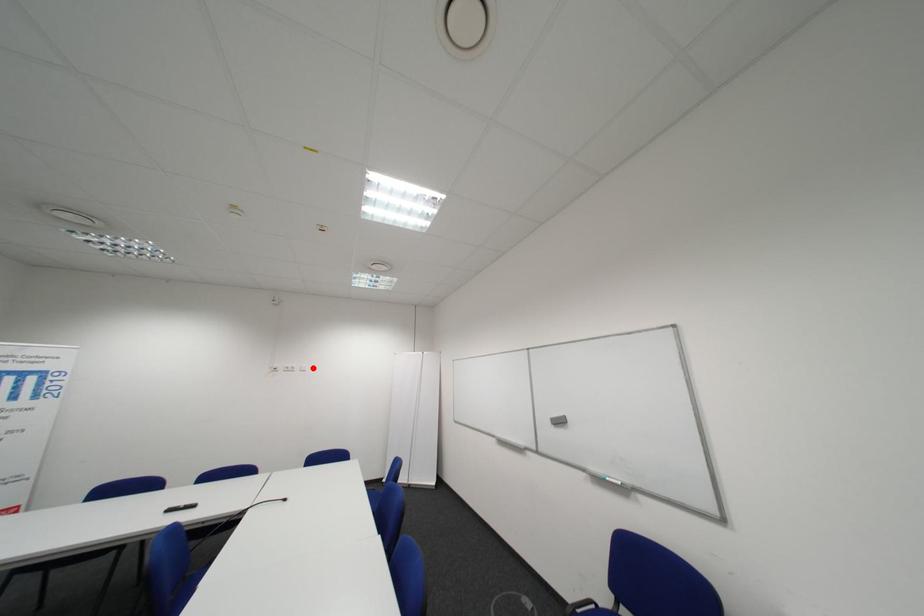
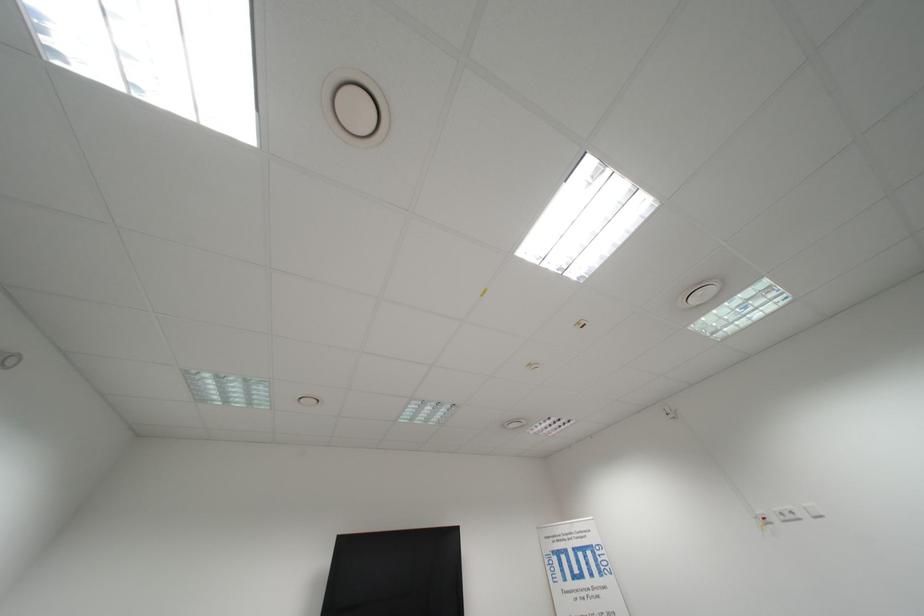
Where in the second image is the point corresponding to the highlighted location from the first image?

(818, 509)